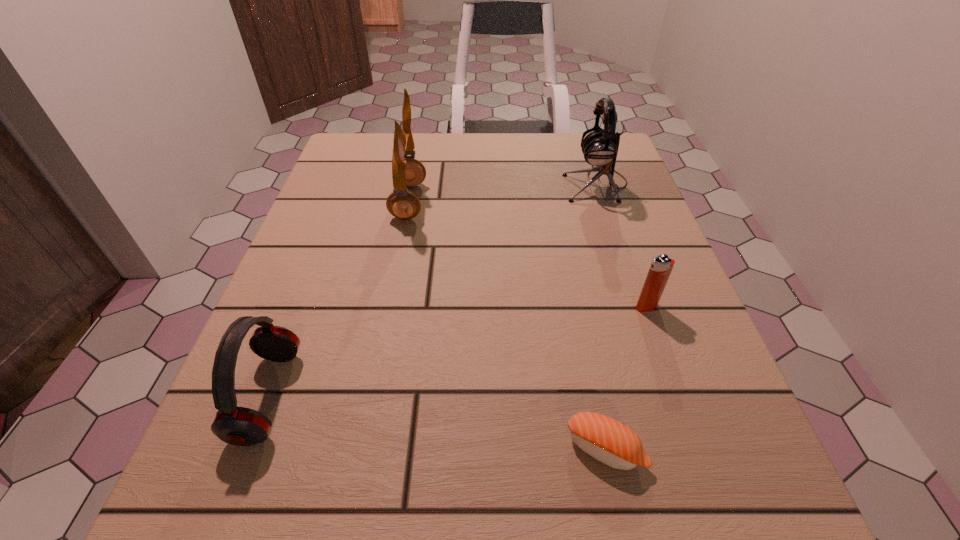
Where is `the second object from left to right`? This screenshot has width=960, height=540. the second object from left to right is located at coordinates (406, 171).

Identify the location of the rightmost earphone. The height and width of the screenshot is (540, 960). (600, 148).

At what (x,y) coordinates should I click in order to perform the action: click on the shortest earphone. Please return your answer as a coordinate pair (x, y). The image size is (960, 540). Looking at the image, I should click on (240, 426).

Identify the location of the leftmost earphone. (240, 426).

Identify the location of the second shortest object. pyautogui.click(x=661, y=267).

Find the location of a particular element. Image resolution: width=960 pixels, height=540 pixels. the third farthest object is located at coordinates (661, 267).

Identify the location of sushi. (607, 440).

Where is `free location located on the front-facing side of the second earphone from right to left`? Image resolution: width=960 pixels, height=540 pixels. free location located on the front-facing side of the second earphone from right to left is located at coordinates (465, 201).

You are a GUI agent. You are given a task and a screenshot of the screen. Output one action in this format:
    pyautogui.click(x=<x>, y=<y>)
    Task: Click on the vacant space positioned 0.370m on the front of the rightmost earphone
    The image size is (960, 540).
    Given the screenshot: What is the action you would take?
    pos(646,335)

The width and height of the screenshot is (960, 540). What are the coordinates of `vacant space situated 0.160m on the ear cups of the third tallest object` in the screenshot? It's located at (400, 396).